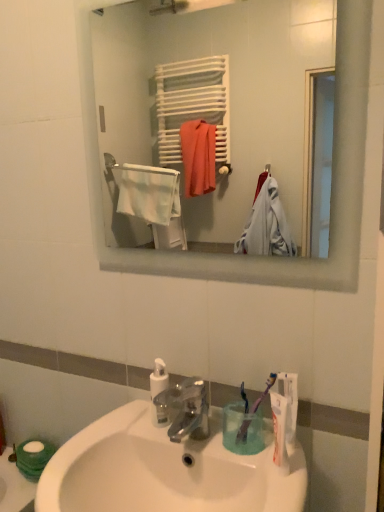
Identify the location of vacant area that is in front of purple plastic toothbrush at lower right, the second toothbrush when ordered from left to right. (275, 468).